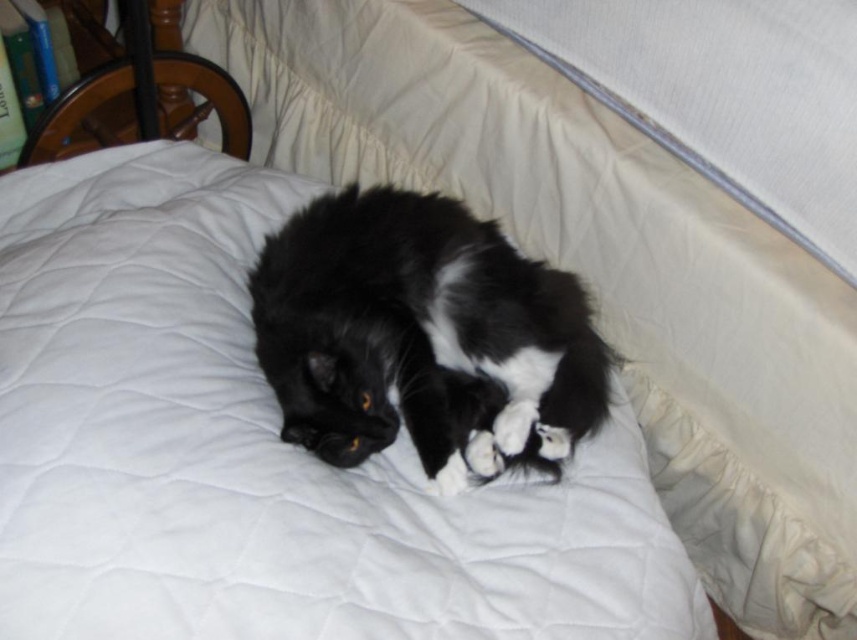
You are holding a camera and want to take a photo of the black and white cat lying on its side on a bed. The camera is positioned at a certain distance. If the point where you want to focus is at coordinates point (16, 388), which is 32.07 inches away from the camera, will you need to adjust your focus to capture the cat clearly?

The point (16, 388) is 32.07 inches from the camera, so you do not need to adjust the focus because the distance is already within the camera focus range to capture the cat clearly.

You are a photographer trying to capture the black soft fur cat at center without the white quilt at center blocking the view. Is the cat currently visible behind the quilt?

The white quilt at center is in front of the black soft fur cat at center, so the cat is partially or fully blocked by the quilt and may not be fully visible.

You are a photographer trying to capture the black soft fur cat at center and the white quilt at center in the same frame. Since the camera can only focus on one subject at a time, which object should you focus on first if you want to ensure the other is still in the background?

You should focus on the black soft fur cat at center first because the white quilt at center is to the left of it, meaning the cat is closer to the camera. This way, the quilt will naturally be in the background and still in focus.